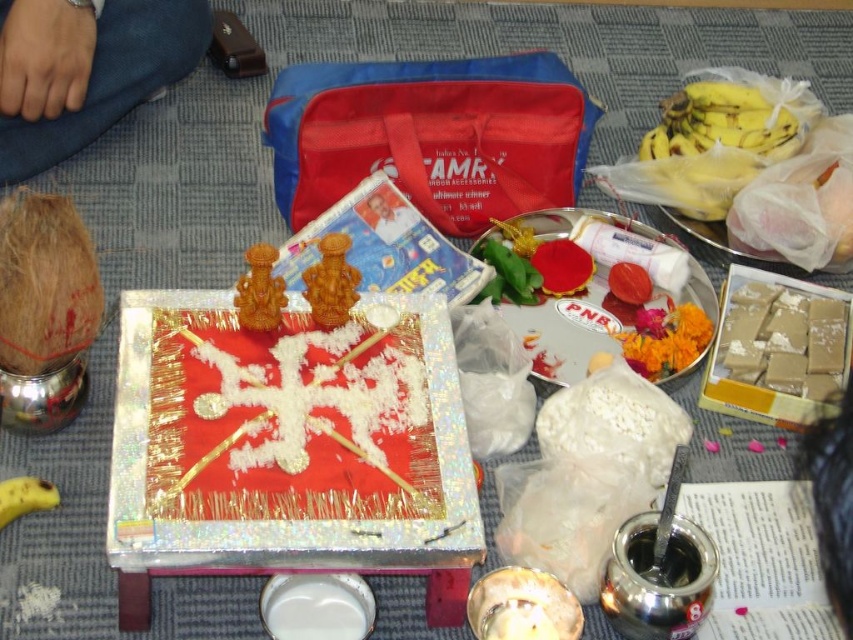
Is shiny metallic tray at center to the left of smooth brown rectangular blocks at center right from the viewer's perspective?

Indeed, shiny metallic tray at center is positioned on the left side of smooth brown rectangular blocks at center right.

Is point (113, 480) positioned in front of point (781, 348)?

Yes.

I want to click on shiny metallic tray at center, so click(277, 456).

Can you confirm if blue denim jeans at upper left is positioned to the right of yellow plastic bag at upper right?

Incorrect, blue denim jeans at upper left is not on the right side of yellow plastic bag at upper right.

What are the coordinates of `blue denim jeans at upper left` in the screenshot? It's located at (85, 70).

Is point (190, 13) behind point (726, 170)?

Yes, point (190, 13) is farther from viewer.

This screenshot has height=640, width=853. I want to click on blue denim jeans at upper left, so click(x=85, y=70).

Who is shorter, red fabric bag at center or blue denim jeans at upper left?

Standing shorter between the two is red fabric bag at center.

Is red fabric bag at center below blue denim jeans at upper left?

Yes.

Locate an element on the screen. The image size is (853, 640). red fabric bag at center is located at coordinates (431, 134).